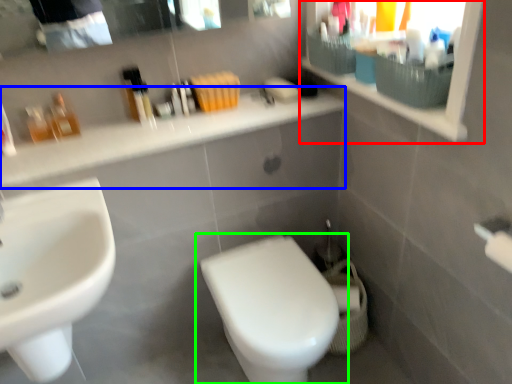
Question: Based on their relative distances, which object is nearer to medicine cabinet (highlighted by a red box)? Choose from counter top (highlighted by a blue box) and toilet (highlighted by a green box).

Choices:
 (A) counter top
 (B) toilet

Answer: (A)